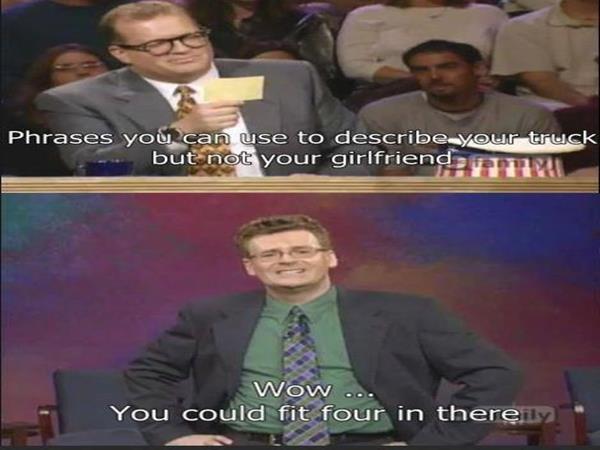
Find the location of a particular element. The height and width of the screenshot is (450, 600). chair is located at coordinates (95, 408).